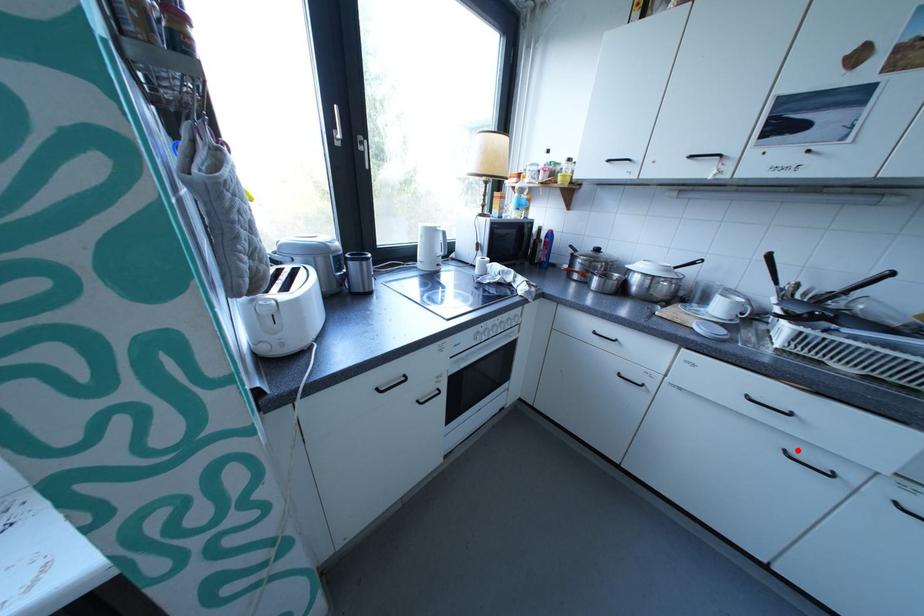
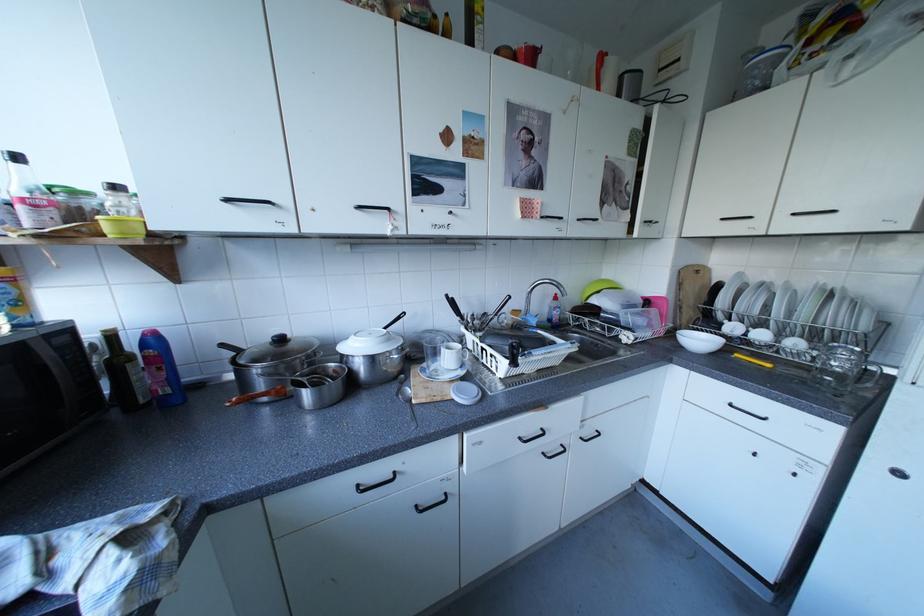
The point at the highlighted location is marked in the first image. Where is the corresponding point in the second image?

(555, 454)